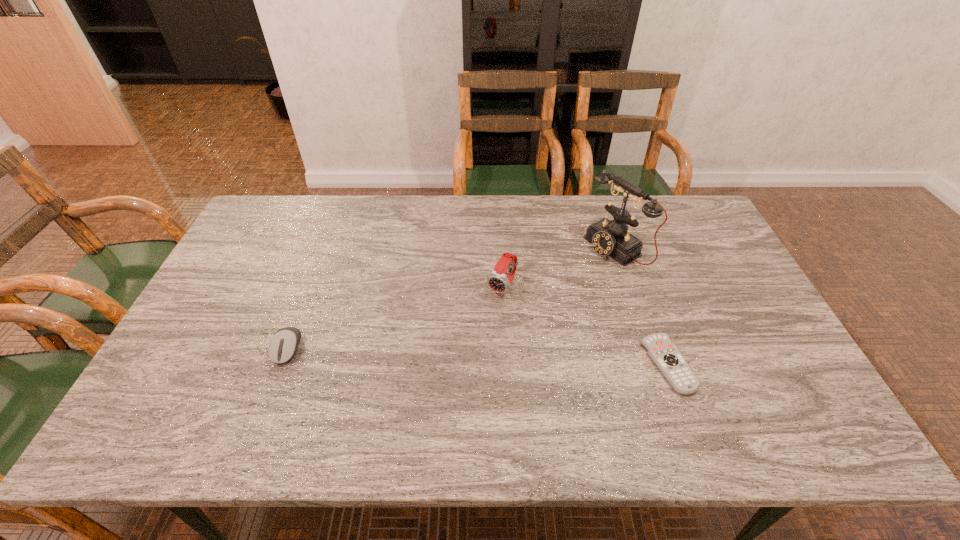
Locate an element on the screen. The width and height of the screenshot is (960, 540). free space on the desktop that is between the computer equipment and the shortest object and is positioned on the face of the second tallest object is located at coordinates (457, 356).

Locate an element on the screen. The width and height of the screenshot is (960, 540). vacant space on the desktop that is between the leftmost object and the remote control and is positioned on the dial of the tallest object is located at coordinates (436, 355).